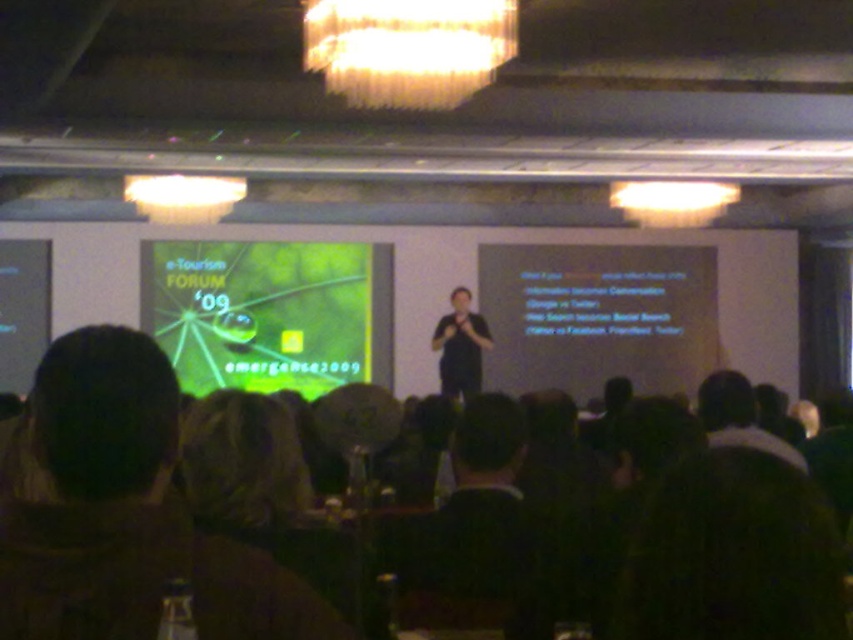
You are standing in the auditorium and want to project a presentation onto the green matte projection screen at center. If your projector has a maximum projection distance of 10 meters, will it be able to project onto the screen?

The distance between the green matte projection screen at center and the viewer is 10.36 meters, which exceeds the projector maximum projection distance of 10 meters. Therefore, the projector will not be able to project onto the screen.

You are a photographer in a presentation setting and want to capture a photo of the dark brown hair at lower left and dark brown hair at center. Which of the two has a wider width?

The dark brown hair at lower left has a wider width than the dark brown hair at center.

From the picture: You are a photographer in the audience taking a photo of the presenter with dark brown hair at center. The camera you are using has a focal length of 50mm. To ensure the presenter is in focus, where should you focus your camera?

You should focus your camera at point (473, 528) where the dark brown hair at center is located.